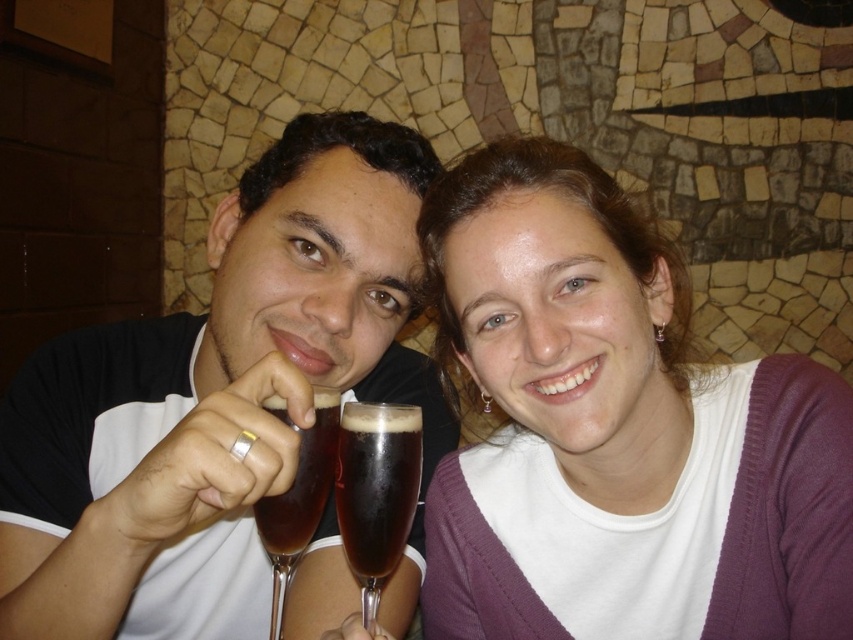
Which of these two, white knitwear at upper right or dark brown glass at center, stands shorter?

Standing shorter between the two is dark brown glass at center.

Measure the distance from white knitwear at upper right to dark brown glass at center.

white knitwear at upper right and dark brown glass at center are 9.23 inches apart from each other.

The image size is (853, 640). Describe the element at coordinates (616, 432) in the screenshot. I see `white knitwear at upper right` at that location.

Find the location of a particular element. Image resolution: width=853 pixels, height=640 pixels. white knitwear at upper right is located at coordinates pos(616,432).

In the scene shown: Does white knitwear at upper right appear over matte black shirt at left?

Correct, white knitwear at upper right is located above matte black shirt at left.

This screenshot has width=853, height=640. What do you see at coordinates (616, 432) in the screenshot?
I see `white knitwear at upper right` at bounding box center [616, 432].

Identify the location of white knitwear at upper right. (616, 432).

Can you confirm if matte black shirt at left is positioned below dark brown glass at center?

Actually, matte black shirt at left is above dark brown glass at center.

Is matte black shirt at left above dark brown glass at center?

Yes, matte black shirt at left is above dark brown glass at center.

Does point (312, 198) come closer to viewer compared to point (395, 531)?

No, (312, 198) is further to viewer.

This screenshot has width=853, height=640. Identify the location of matte black shirt at left. (213, 397).